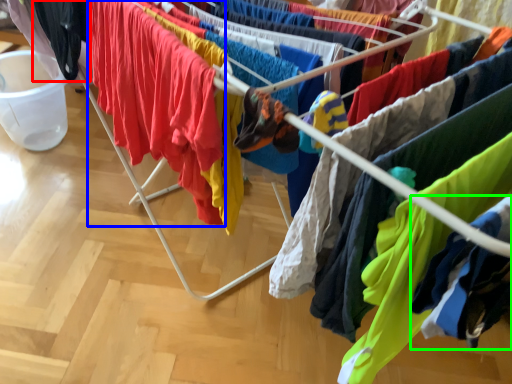
Question: Which object is positioned closest to clothing (highlighted by a red box)? Select from clothing (highlighted by a blue box) and clothing (highlighted by a green box).

Choices:
 (A) clothing
 (B) clothing

Answer: (A)